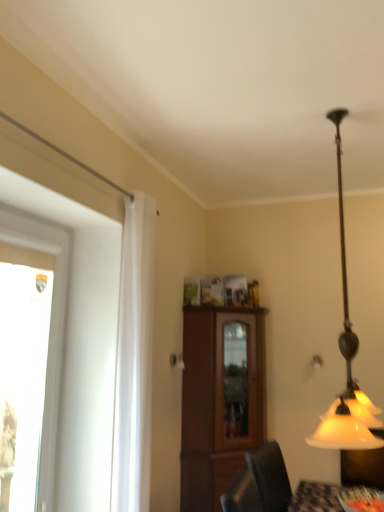
Question: Is brown wood cabinet at center not near white sheer curtain at left?

Choices:
 (A) yes
 (B) no

Answer: (A)

Question: Can you confirm if brown wood cabinet at center is positioned to the left of white sheer curtain at left?

Choices:
 (A) no
 (B) yes

Answer: (A)

Question: Is brown wood cabinet at center at the right side of white sheer curtain at left?

Choices:
 (A) yes
 (B) no

Answer: (A)

Question: Is white sheer curtain at left located within brown wood cabinet at center?

Choices:
 (A) yes
 (B) no

Answer: (B)

Question: Can you confirm if brown wood cabinet at center is smaller than white sheer curtain at left?

Choices:
 (A) yes
 (B) no

Answer: (B)

Question: From the image's perspective, is white sheer curtain at left above or below matte glass lampshade at right?

Choices:
 (A) above
 (B) below

Answer: (B)

Question: Is white sheer curtain at left in front of or behind matte glass lampshade at right in the image?

Choices:
 (A) front
 (B) behind

Answer: (B)

Question: In terms of width, does white sheer curtain at left look wider or thinner when compared to matte glass lampshade at right?

Choices:
 (A) wide
 (B) thin

Answer: (B)

Question: From a real-world perspective, is white sheer curtain at left positioned above or below matte glass lampshade at right?

Choices:
 (A) above
 (B) below

Answer: (B)

Question: From the image's perspective, relative to white sheer curtain at left, is transparent glass window at left above or below?

Choices:
 (A) below
 (B) above

Answer: (A)

Question: Is transparent glass window at left in front of or behind white sheer curtain at left in the image?

Choices:
 (A) behind
 (B) front

Answer: (B)

Question: From a real-world perspective, is transparent glass window at left physically located above or below white sheer curtain at left?

Choices:
 (A) above
 (B) below

Answer: (B)

Question: Looking at their shapes, would you say transparent glass window at left is wider or thinner than white sheer curtain at left?

Choices:
 (A) thin
 (B) wide

Answer: (A)

Question: Looking at their shapes, would you say brown wood cabinet at center is wider or thinner than white sheer curtain at left?

Choices:
 (A) wide
 (B) thin

Answer: (A)

Question: From the image's perspective, is brown wood cabinet at center above or below white sheer curtain at left?

Choices:
 (A) above
 (B) below

Answer: (B)